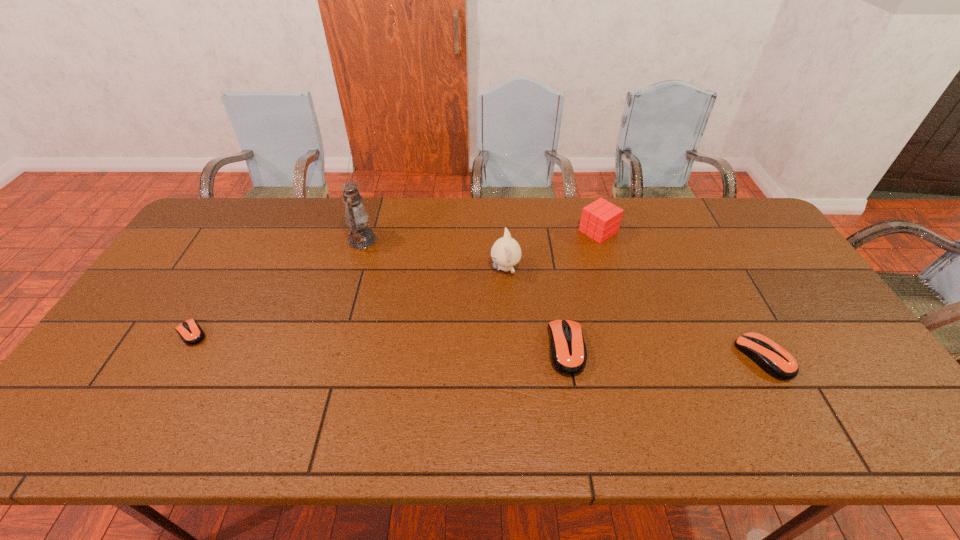
Where is `the shortest computer mouse`? the shortest computer mouse is located at coordinates (190, 332).

This screenshot has width=960, height=540. In order to click on the leftmost computer mouse in this screenshot , I will do `click(190, 332)`.

Find the location of a particular element. This screenshot has width=960, height=540. the fourth object from left to right is located at coordinates (568, 352).

The image size is (960, 540). In order to click on the rightmost object in this screenshot , I will do `click(776, 361)`.

Where is `the second shortest computer mouse`? The image size is (960, 540). the second shortest computer mouse is located at coordinates (776, 361).

Where is `the tallest object`? Image resolution: width=960 pixels, height=540 pixels. the tallest object is located at coordinates point(360,237).

Identify the location of oil lamp. This screenshot has height=540, width=960. (360, 237).

This screenshot has width=960, height=540. Identify the location of the fifth shortest object. (506, 252).

Where is `kitten`? The image size is (960, 540). kitten is located at coordinates (506, 252).

Where is `the fourth shortest object`? This screenshot has width=960, height=540. the fourth shortest object is located at coordinates (600, 220).